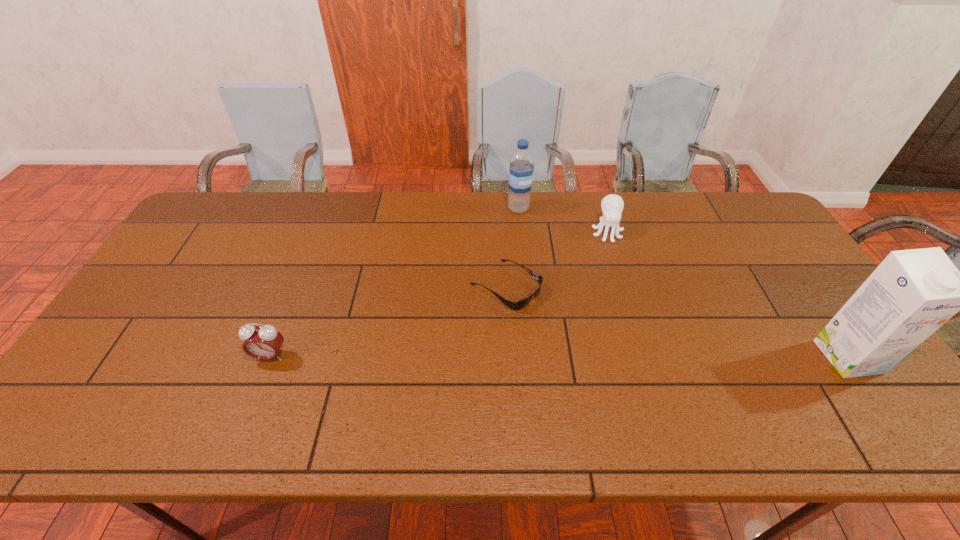
Where is `vacant area that lies between the rightmost object and the leftmost object`? The image size is (960, 540). vacant area that lies between the rightmost object and the leftmost object is located at coordinates (559, 356).

Find the location of `free area in between the second farthest object and the farthest object`. free area in between the second farthest object and the farthest object is located at coordinates (563, 220).

Identify the location of empty location between the tallest object and the alarm clock. The width and height of the screenshot is (960, 540). (559, 356).

The image size is (960, 540). Find the location of `free space between the second farthest object and the leftmost object`. free space between the second farthest object and the leftmost object is located at coordinates (439, 294).

Locate an element on the screen. The height and width of the screenshot is (540, 960). free space between the fourth nearest object and the carton is located at coordinates (728, 294).

Find the location of `free area in between the tallest object and the fourth nearest object`. free area in between the tallest object and the fourth nearest object is located at coordinates coord(728,294).

You are a GUI agent. You are given a task and a screenshot of the screen. Output one action in this format:
    pyautogui.click(x=<x>, y=<y>)
    Task: Click on the free space between the fourth shortest object and the rightmost object
    
    Given the screenshot: What is the action you would take?
    pyautogui.click(x=684, y=282)

Where is `free space that is in between the rightmost object and the octopus`? The width and height of the screenshot is (960, 540). free space that is in between the rightmost object and the octopus is located at coordinates (728, 294).

Identify which object is located as the fourth nearest to the water bottle. Please provide its 2D coordinates. Your answer should be formatted as a tuple, i.e. [(x, y)], where the tuple contains the x and y coordinates of a point satisfying the conditions above.

[(912, 293)]

Identify which object is the nearest to the fourth nearest object. Please provide its 2D coordinates. Your answer should be formatted as a tuple, i.e. [(x, y)], where the tuple contains the x and y coordinates of a point satisfying the conditions above.

[(521, 169)]